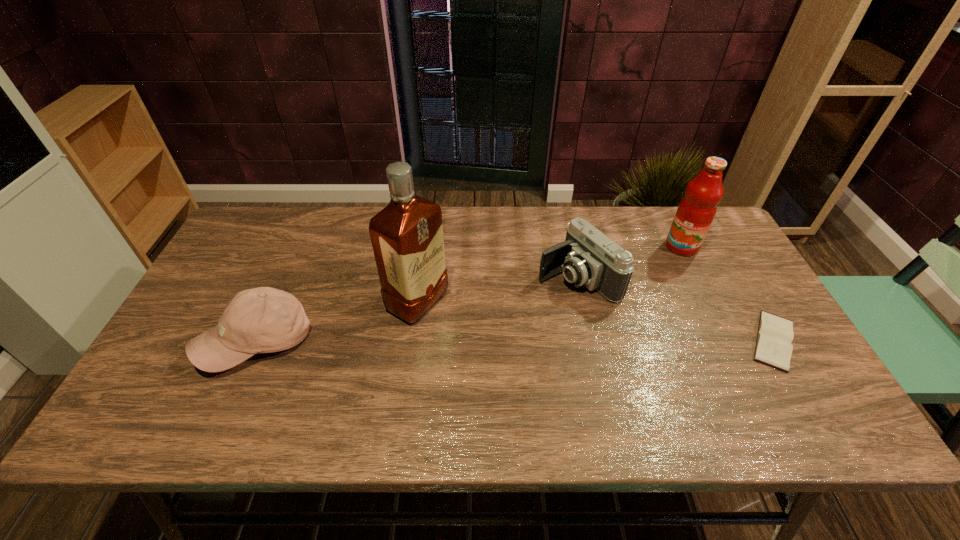
The image size is (960, 540). What are the coordinates of `free space on the desktop that is between the baseball cap and the shortest object and is positioned on the front label of the second object from left to right` in the screenshot? It's located at (486, 341).

At what (x,y) coordinates should I click in order to perform the action: click on vacant space on the desktop that is between the baseball cap and the shortest object and is positioned on the front label of the fruit juice. Please return your answer as a coordinate pair (x, y). The image size is (960, 540). Looking at the image, I should click on 592,341.

Identify the location of vacant spot on the desktop that is between the baseball cap and the diary and is positioned at the front of the camera with an open lens cover. (449, 341).